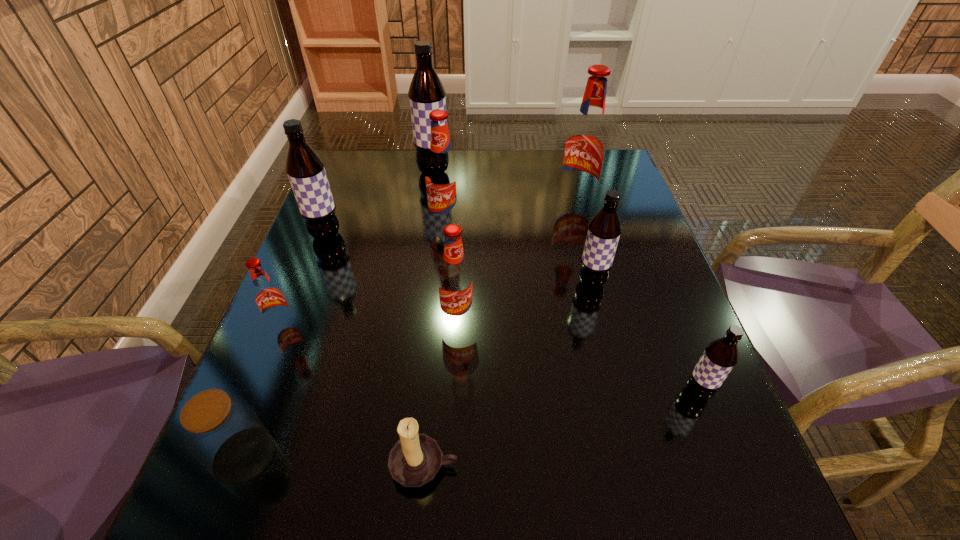
Locate which red root beer ranks in proximity to the fifth farthest root beer. Please provide its 2D coordinates. Your answer should be formatted as a tuple, i.e. [(x, y)], where the tuple contains the x and y coordinates of a point satisfying the conditions above.

[(586, 143)]

Choose which red root beer is the third nearest neighbor to the third nearest red root beer. Please provide its 2D coordinates. Your answer should be formatted as a tuple, i.e. [(x, y)], where the tuple contains the x and y coordinates of a point satisfying the conditions above.

[(269, 297)]

Where is `free space that satisfies the following two spatial constraints: 1. on the front side of the third smallest red root beer; 2. on the right side of the fourth nearest root beer`? The width and height of the screenshot is (960, 540). free space that satisfies the following two spatial constraints: 1. on the front side of the third smallest red root beer; 2. on the right side of the fourth nearest root beer is located at coordinates (441, 283).

Locate an element on the screen. This screenshot has height=540, width=960. free region that satisfies the following two spatial constraints: 1. on the front side of the fourth nearest root beer; 2. on the left side of the second biggest red root beer is located at coordinates (441, 283).

This screenshot has width=960, height=540. Find the location of `free space that satisfies the following two spatial constraints: 1. on the front side of the fourth nearest root beer; 2. on the right side of the third smallest red root beer`. free space that satisfies the following two spatial constraints: 1. on the front side of the fourth nearest root beer; 2. on the right side of the third smallest red root beer is located at coordinates coord(441,283).